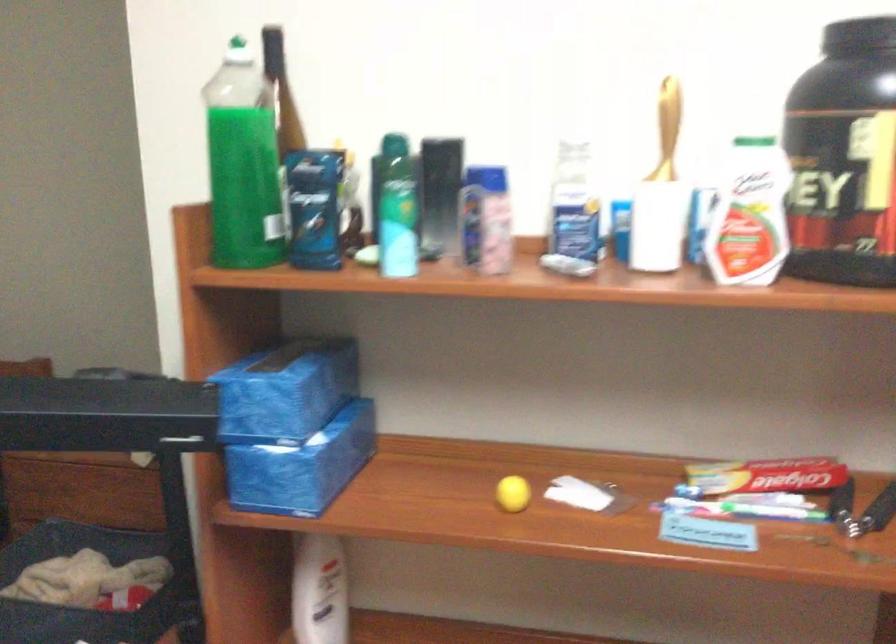
What do you see at coordinates (243, 163) in the screenshot?
I see `the large green bottle` at bounding box center [243, 163].